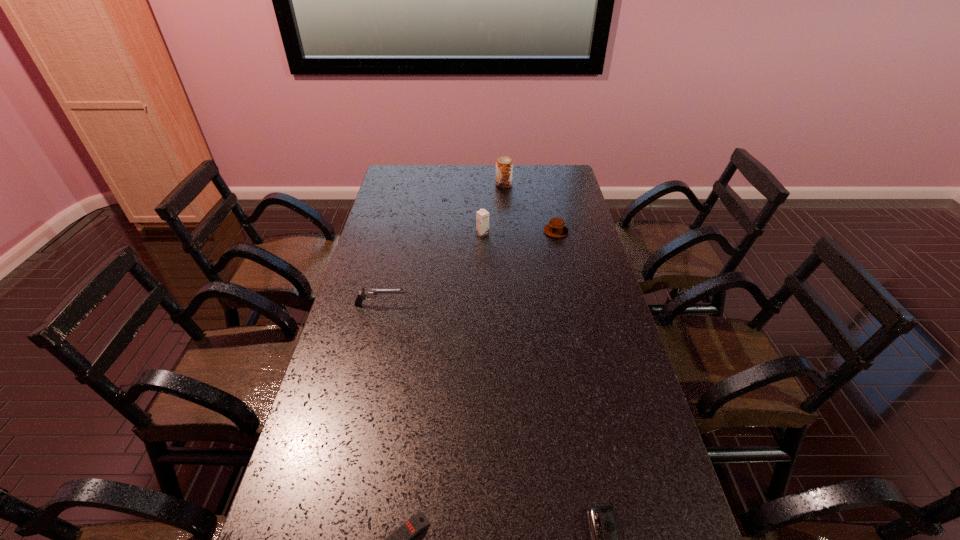
You are a GUI agent. You are given a task and a screenshot of the screen. Output one action in this format:
    pyautogui.click(x=<x>, y=<y>)
    Task: Click on the free location located 0.400m on the back of the third shortest object
    The height and width of the screenshot is (540, 960).
    Given the screenshot: What is the action you would take?
    pyautogui.click(x=543, y=177)

Image resolution: width=960 pixels, height=540 pixels. In order to click on object situated at the far edge in this screenshot , I will do `click(504, 166)`.

Locate an element on the screen. The height and width of the screenshot is (540, 960). object located in the left edge section of the desktop is located at coordinates (365, 293).

This screenshot has width=960, height=540. In order to click on object located at the right edge in this screenshot , I will do `click(555, 228)`.

I want to click on free spot at the far edge of the desktop, so click(516, 185).

In the image, there is a desktop. Where is `free space at the left edge`? The height and width of the screenshot is (540, 960). free space at the left edge is located at coordinates (391, 329).

What are the coordinates of `vacant space at the right edge of the desktop` in the screenshot? It's located at (607, 399).

Image resolution: width=960 pixels, height=540 pixels. In the image, there is a desktop. Identify the location of vacant space at the far left corner. (407, 171).

Where is `vacant space at the far right corner of the desktop`? vacant space at the far right corner of the desktop is located at coordinates (538, 178).

Image resolution: width=960 pixels, height=540 pixels. In order to click on vacant point located between the farthest object and the pistol in this screenshot , I will do `click(443, 245)`.